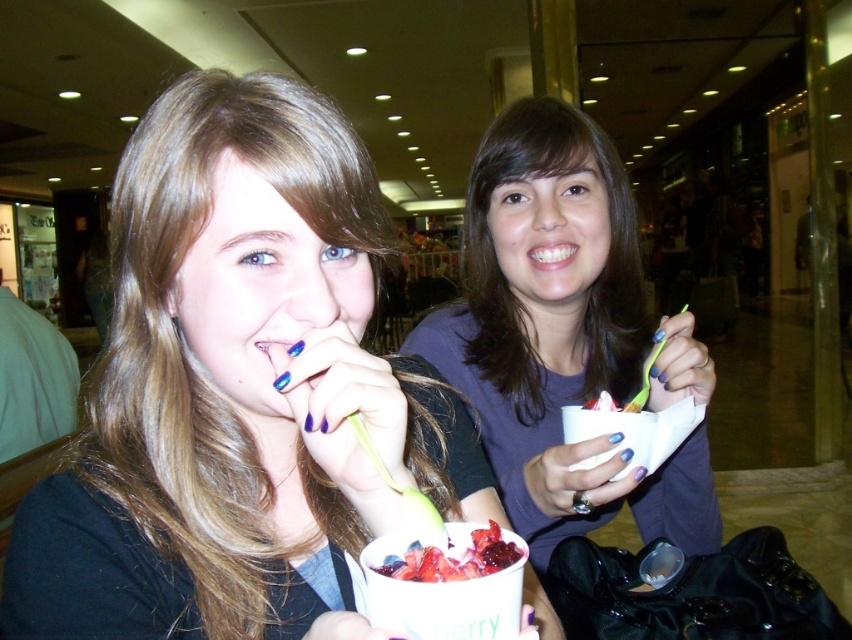
Question: Which object appears farthest from the camera in this image?

Choices:
 (A) smooth strawberry dessert at center
 (B) matte black shirt at center
 (C) matte purple shirt at center

Answer: (C)

Question: Considering the real-world distances, which object is closest to the matte purple shirt at center?

Choices:
 (A) blue nail polish at mouth left
 (B) matte black shirt at center
 (C) smooth strawberry dessert at center

Answer: (B)

Question: Is the position of matte purple shirt at center more distant than that of smooth strawberry dessert at center?

Choices:
 (A) yes
 (B) no

Answer: (A)

Question: Does matte black shirt at center have a greater width compared to matte purple shirt at center?

Choices:
 (A) yes
 (B) no

Answer: (A)

Question: Can you confirm if matte purple shirt at center is smaller than blue nail polish at mouth left?

Choices:
 (A) yes
 (B) no

Answer: (B)

Question: Which object is farther from the camera taking this photo?

Choices:
 (A) matte purple shirt at center
 (B) matte black shirt at center
 (C) smooth strawberry dessert at center
 (D) blue nail polish at mouth left

Answer: (A)